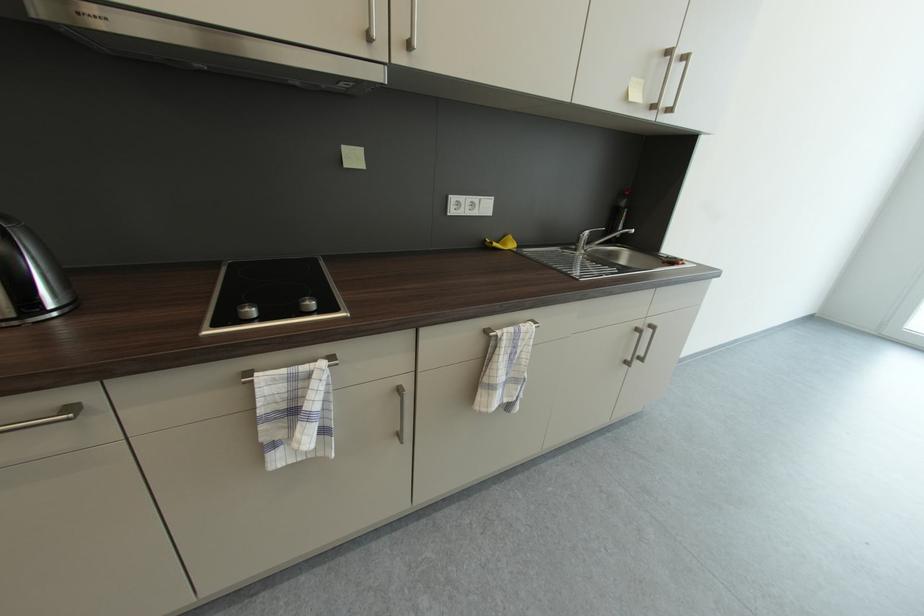
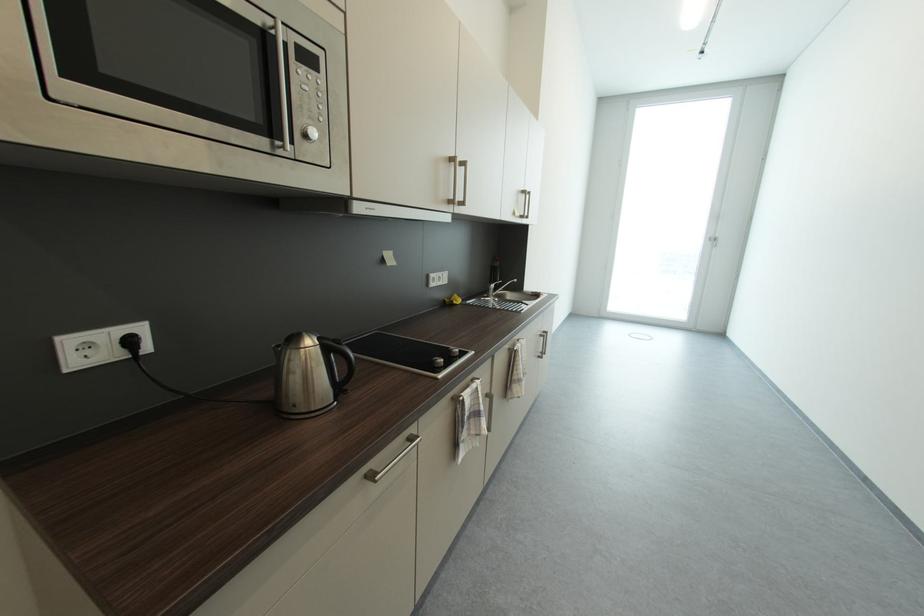
In the second image, find the point that corresponds to [675,54] in the first image.

(529, 193)